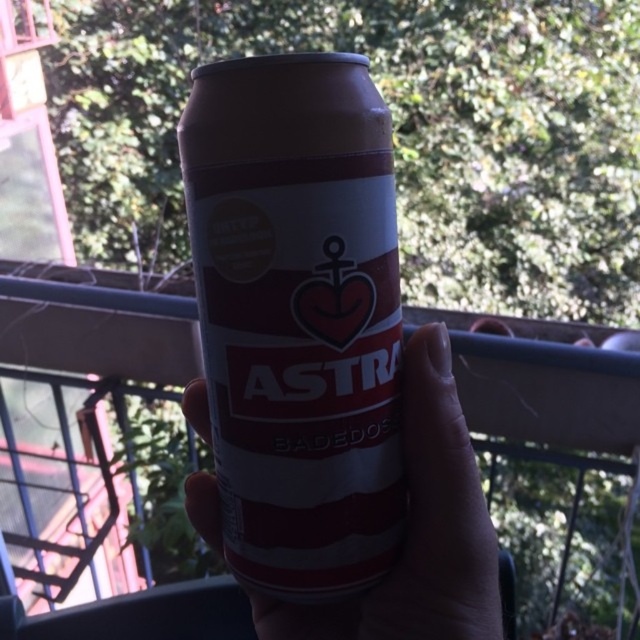
You are an assistant helping someone organize their pantry. You see a matte red can at center and a matte plastic can at center. Which one is placed higher?

The matte red can at center is positioned over the matte plastic can at center, so it is placed higher.